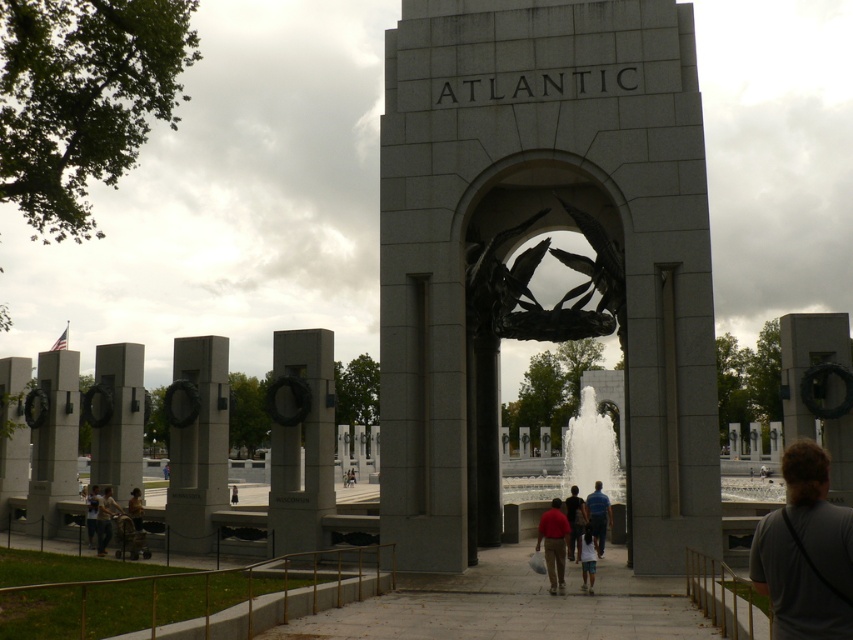
The height and width of the screenshot is (640, 853). What do you see at coordinates (196, 440) in the screenshot?
I see `black stone wreath at left` at bounding box center [196, 440].

Between point (196, 524) and point (589, 586), which one is positioned behind?

Point (196, 524)

Where is `black stone wreath at left`? The width and height of the screenshot is (853, 640). black stone wreath at left is located at coordinates (196, 440).

Identify the location of wooden cane at lower left. (129, 538).

Which is behind, point (123, 550) or point (91, 520)?

Positioned behind is point (91, 520).

Which is behind, point (115, 556) or point (93, 547)?

Positioned behind is point (93, 547).

Where is `wooden cane at lower left`? wooden cane at lower left is located at coordinates (129, 538).

Can you confirm if white marble fountain at center is smaller than brown leather jacket at center?

No, white marble fountain at center is not smaller than brown leather jacket at center.

Is white marble fountain at center thinner than brown leather jacket at center?

No.

Is point (616, 497) behind point (134, 520)?

Yes.

This screenshot has width=853, height=640. I want to click on white marble fountain at center, so click(592, 451).